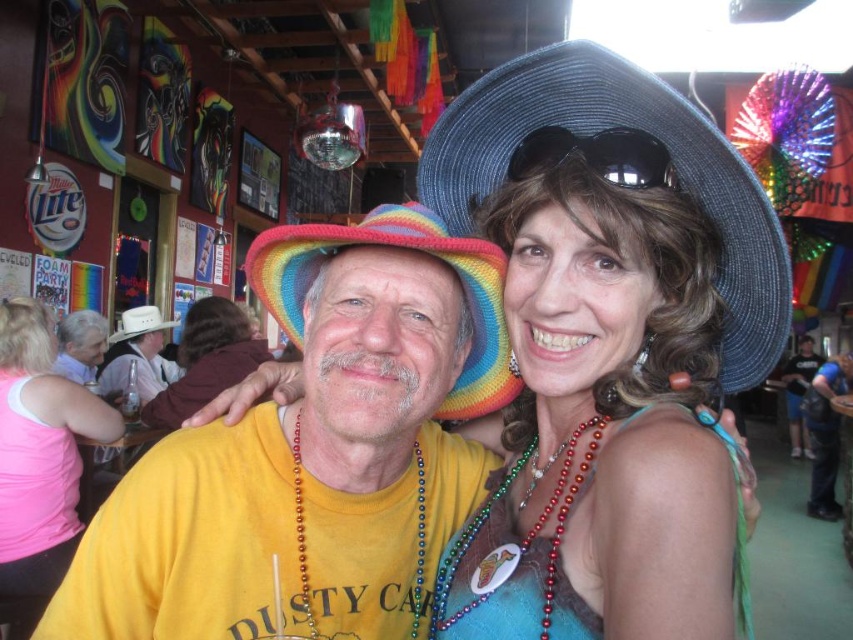
You are a photographer at this event and need to decide where to place a spotlight. The spotlight can only illuminate objects that are wider than 30 cm. Based on the scene, will the shiny blue dress at center or the white leather cowboy hat at left be illuminated?

The white leather cowboy hat at left is wider than the shiny blue dress at center, so the spotlight will illuminate the white leather cowboy hat at left since it is wider than 30 cm.